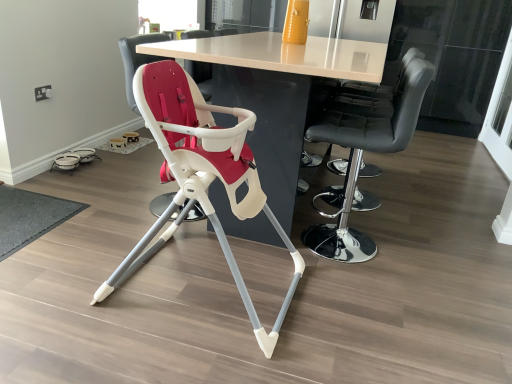
You are a GUI agent. You are given a task and a screenshot of the screen. Output one action in this format:
    pyautogui.click(x=<x>, y=<y>)
    Task: Click on the vacant region in front of black leather bar stool at right, marked as the third chair in a left-to-right arrangement
    
    Given the screenshot: What is the action you would take?
    pyautogui.click(x=367, y=291)